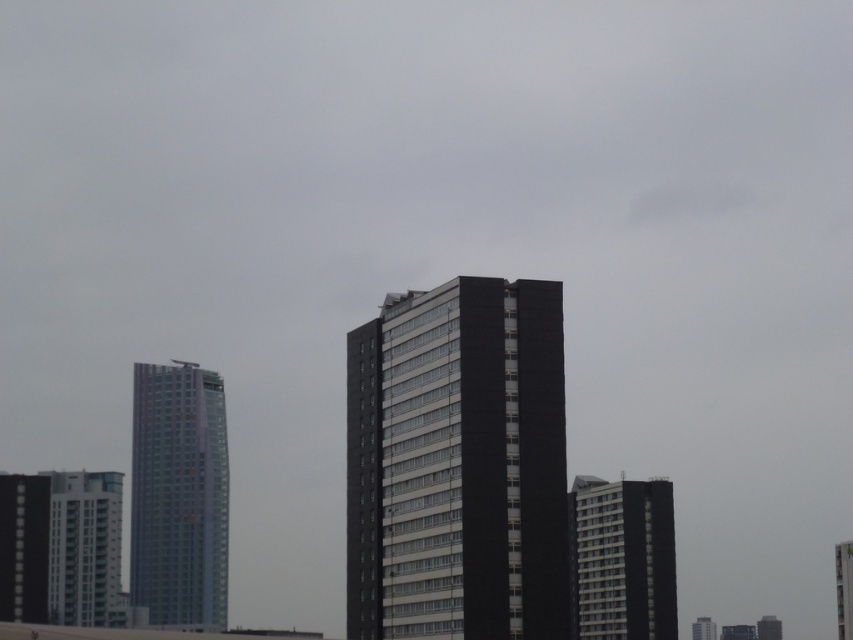
Is transparent glass tower at left positioned at the back of matte black building at left?

Yes.

The height and width of the screenshot is (640, 853). Identify the location of transparent glass tower at left. [x=178, y=496].

Is point (148, 570) less distant than point (6, 611)?

No, (148, 570) is behind (6, 611).

In order to click on transparent glass tower at left in this screenshot , I will do `click(178, 496)`.

Looking at this image, measure the distance between white glossy building at lower right and camera.

They are 569.65 feet apart.

Is white glossy building at lower right above smooth glass tower at center?

Correct, white glossy building at lower right is located above smooth glass tower at center.

Find the location of `white glossy building at lower right`. white glossy building at lower right is located at coordinates (843, 588).

Identify the location of white glossy building at lower right. (843, 588).

Does white glossy building at right appear under matte black building at left?

Correct, white glossy building at right is located below matte black building at left.

Does white glossy building at right come behind matte black building at left?

That is False.

Measure the distance between white glossy building at right and camera.

They are 336.84 feet apart.

Where is `white glossy building at right`? This screenshot has width=853, height=640. white glossy building at right is located at coordinates (621, 560).